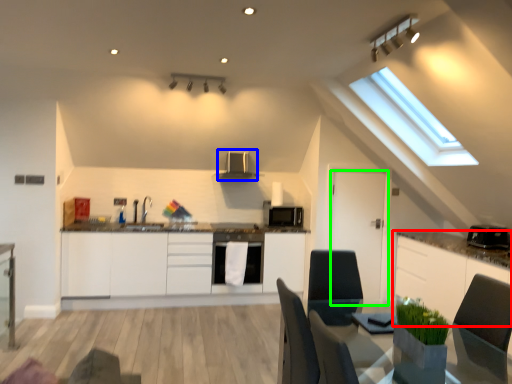
Question: Which is farther away from cabinetry (highlighted by a red box)? exhaust hood (highlighted by a blue box) or door (highlighted by a green box)?

Choices:
 (A) exhaust hood
 (B) door

Answer: (A)